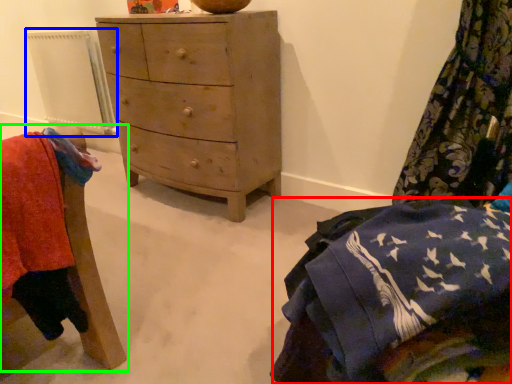
Question: Which is farther away from clothing (highlighted by a red box)? radiator (highlighted by a blue box) or furniture (highlighted by a green box)?

Choices:
 (A) radiator
 (B) furniture

Answer: (A)